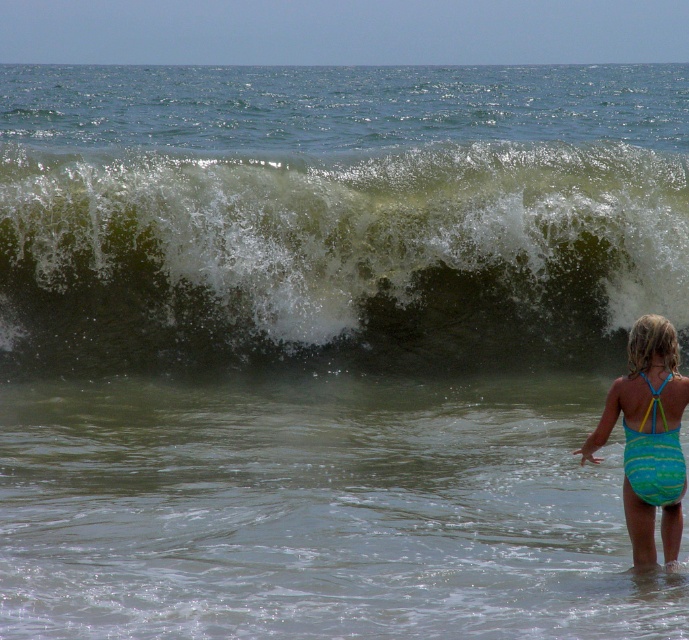
You are standing at the beach looking at the scene. There are two points marked in the image. The first point is at coordinates point [96,285] and the second is at point [678,499]. Which point is closer to you?

Point [96,285] is closer to you because it is further to the viewer than point [678,499].